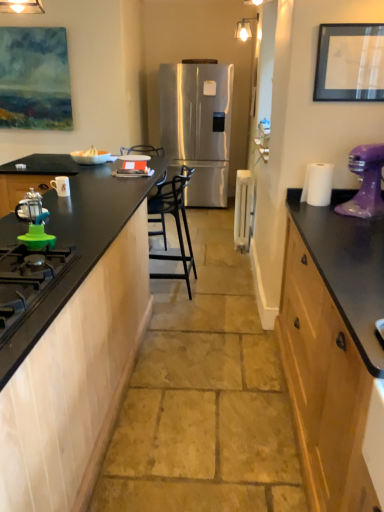
Question: Is white plastic radiator at center, the 1th appliance viewed from the right, inside green plastic lid at lower left, arranged as the first appliance when viewed from the front?

Choices:
 (A) yes
 (B) no

Answer: (B)

Question: Would you say green plastic lid at lower left, placed as the second appliance when sorted from right to left, is outside white plastic radiator at center, the fifth appliance positioned from the left?

Choices:
 (A) no
 (B) yes

Answer: (B)

Question: Does green plastic lid at lower left, placed as the second appliance when sorted from right to left, touch white plastic radiator at center, the 1th appliance viewed from the right?

Choices:
 (A) no
 (B) yes

Answer: (A)

Question: Considering the relative positions of green plastic lid at lower left, positioned as the fourth appliance in left-to-right order, and white plastic radiator at center, arranged as the first appliance when viewed from the back, in the image provided, is green plastic lid at lower left, positioned as the fourth appliance in left-to-right order, to the left of white plastic radiator at center, arranged as the first appliance when viewed from the back, from the viewer's perspective?

Choices:
 (A) yes
 (B) no

Answer: (A)

Question: Is green plastic lid at lower left, which appears as the 5th appliance when viewed from the back, oriented away from white plastic radiator at center, arranged as the first appliance when viewed from the back?

Choices:
 (A) yes
 (B) no

Answer: (B)

Question: From the image's perspective, is stainless steel refrigerator at center positioned above or below purple glossy stand mixer at right?

Choices:
 (A) above
 (B) below

Answer: (A)

Question: Is stainless steel refrigerator at center bigger or smaller than purple glossy stand mixer at right?

Choices:
 (A) small
 (B) big

Answer: (B)

Question: Is stainless steel refrigerator at center in front of or behind purple glossy stand mixer at right in the image?

Choices:
 (A) behind
 (B) front

Answer: (A)

Question: Considering the positions of stainless steel refrigerator at center and purple glossy stand mixer at right in the image, is stainless steel refrigerator at center taller or shorter than purple glossy stand mixer at right?

Choices:
 (A) tall
 (B) short

Answer: (A)

Question: Based on their positions, is black matte picture frame at upper right located to the left or right of black metal chair at center?

Choices:
 (A) left
 (B) right

Answer: (B)

Question: Considering the positions of point (377, 90) and point (163, 254), is point (377, 90) closer or farther from the camera than point (163, 254)?

Choices:
 (A) closer
 (B) farther

Answer: (A)

Question: In terms of height, does black matte picture frame at upper right look taller or shorter compared to black metal chair at center?

Choices:
 (A) short
 (B) tall

Answer: (A)

Question: Considering the positions of black matte picture frame at upper right and black metal chair at center in the image, is black matte picture frame at upper right bigger or smaller than black metal chair at center?

Choices:
 (A) big
 (B) small

Answer: (B)

Question: In the image, is stainless steel refrigerator at center on the left side or the right side of green rubber gas stove at lower left?

Choices:
 (A) right
 (B) left

Answer: (A)

Question: Is stainless steel refrigerator at center in front of or behind green rubber gas stove at lower left in the image?

Choices:
 (A) front
 (B) behind

Answer: (B)